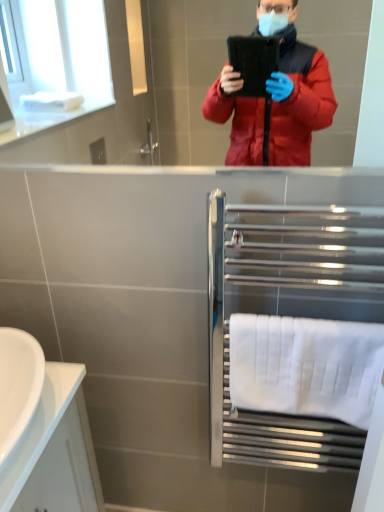
Question: Is point (11, 403) positioned closer to the camera than point (355, 384)?

Choices:
 (A) closer
 (B) farther

Answer: (A)

Question: Is white glossy sink at lower left taller or shorter than white cotton towel at lower right?

Choices:
 (A) tall
 (B) short

Answer: (B)

Question: Which is nearer to the white cotton towel at lower right?

Choices:
 (A) white glossy sink at lower left
 (B) polished chrome towel rack at lower right

Answer: (B)

Question: Based on their relative distances, which object is farther from the polished chrome towel rack at lower right?

Choices:
 (A) white cotton towel at lower right
 (B) white glossy sink at lower left

Answer: (B)